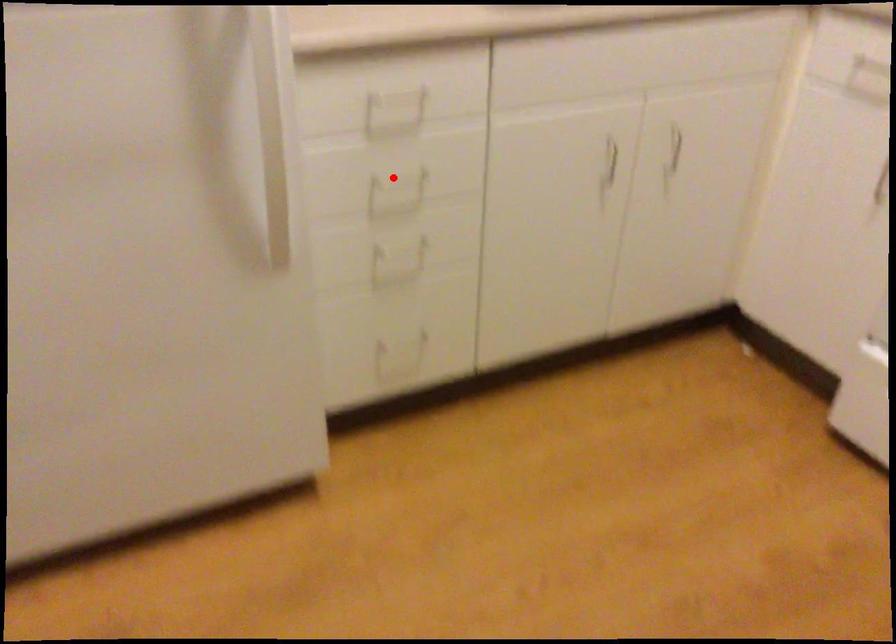
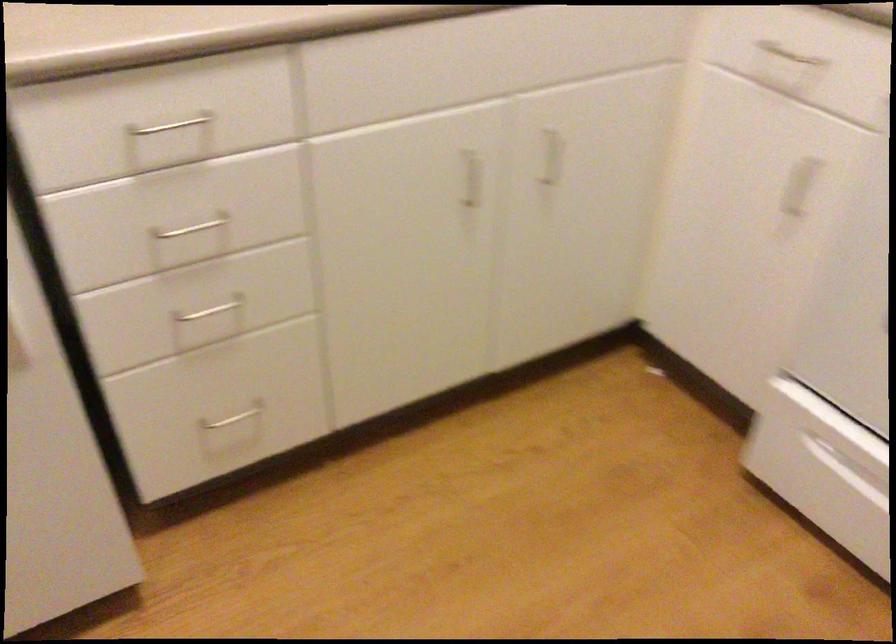
Question: A red point is marked in image1. In image2, is the corresponding 3D point closer to the camera or farther? Reply with the corresponding letter.

Choices:
 (A) The corresponding 3D point is closer.
 (B) The corresponding 3D point is farther.

Answer: (A)